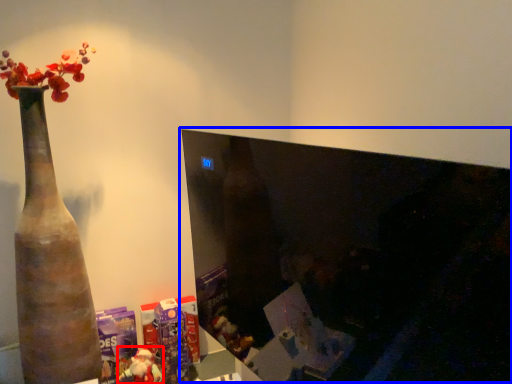
Question: Which of the following is the farthest to the observer, toy (highlighted by a red box) or computer monitor (highlighted by a blue box)?

Choices:
 (A) toy
 (B) computer monitor

Answer: (A)